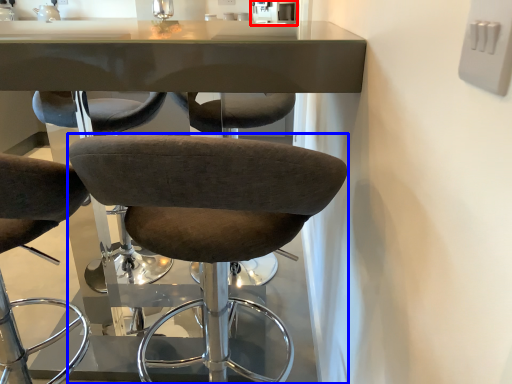
Question: Which object is closer to the camera taking this photo, sink (highlighted by a red box) or chair (highlighted by a blue box)?

Choices:
 (A) sink
 (B) chair

Answer: (B)